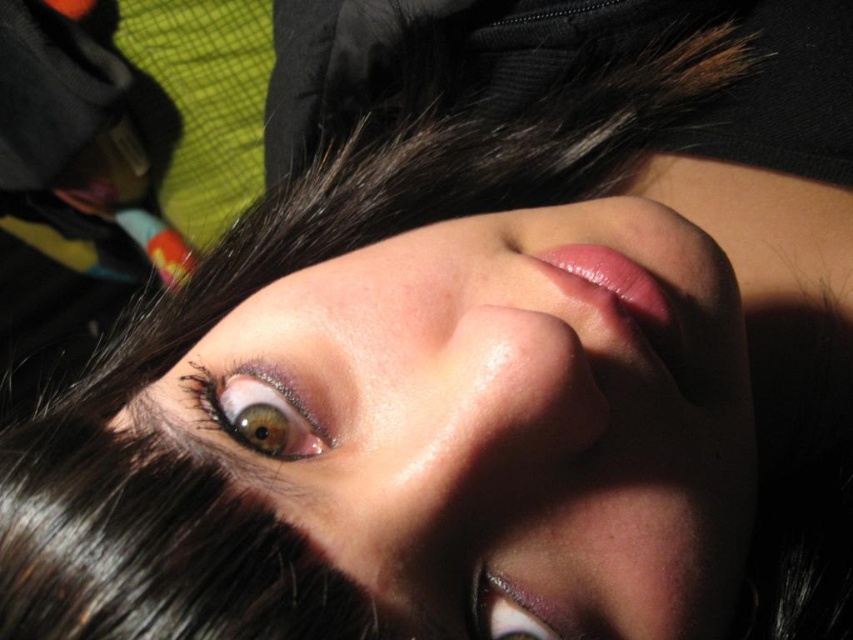
Question: Based on their relative distances, which object is farther from the shiny brown eye at center?

Choices:
 (A) shiny brown eye at upper left
 (B) smooth skin face at center

Answer: (A)

Question: Does shiny brown eye at upper left have a greater width compared to shiny brown eye at center?

Choices:
 (A) yes
 (B) no

Answer: (A)

Question: Does shiny brown eye at upper left appear over shiny brown eye at center?

Choices:
 (A) yes
 (B) no

Answer: (A)

Question: Considering the real-world distances, which object is closest to the smooth skin face at center?

Choices:
 (A) shiny brown eye at center
 (B) shiny brown eye at upper left

Answer: (A)

Question: Which of the following is the closest to the observer?

Choices:
 (A) shiny brown eye at upper left
 (B) shiny brown eye at center
 (C) smooth skin face at center

Answer: (C)

Question: Is shiny brown eye at upper left below shiny brown eye at center?

Choices:
 (A) no
 (B) yes

Answer: (A)